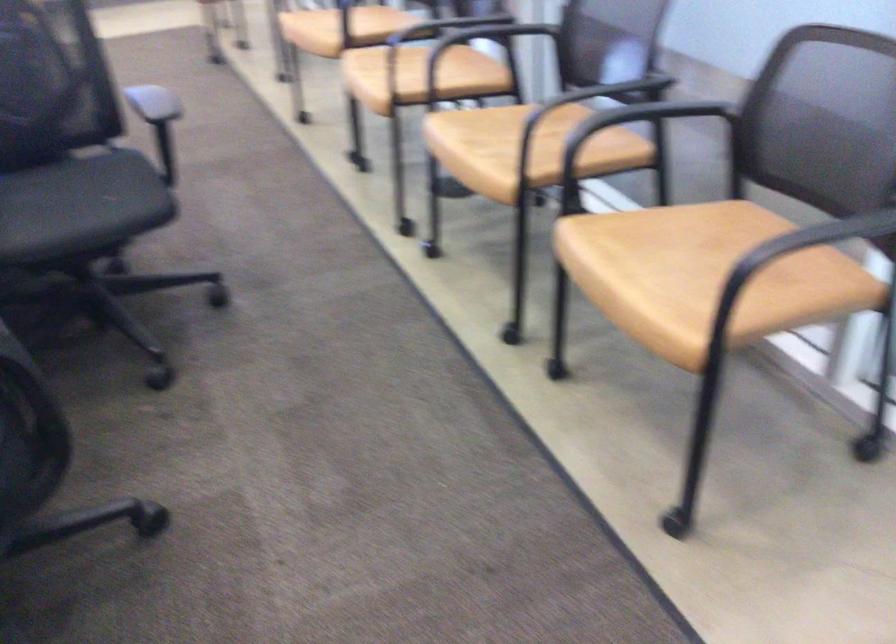
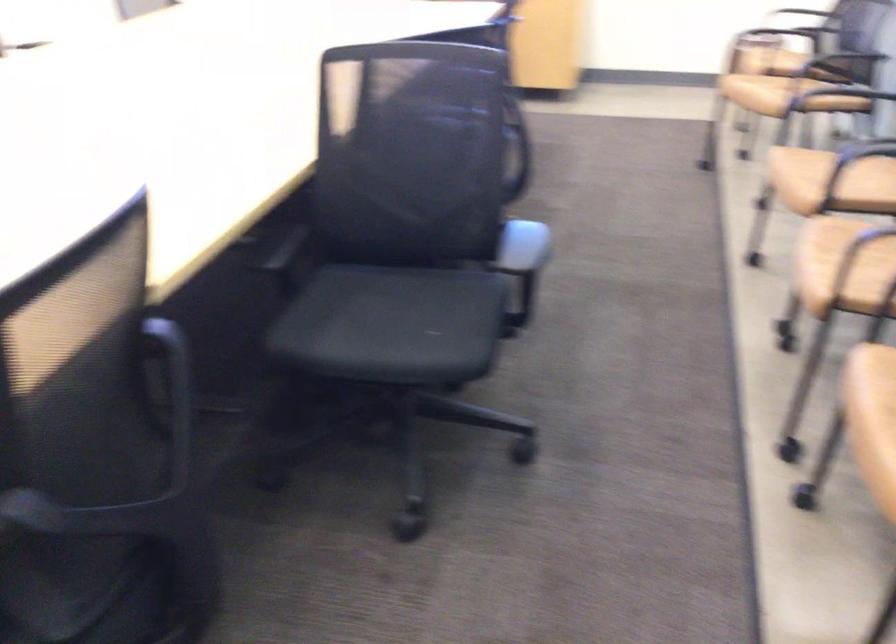
Find the pixel in the second image that matches (170,106) in the first image.

(523, 250)